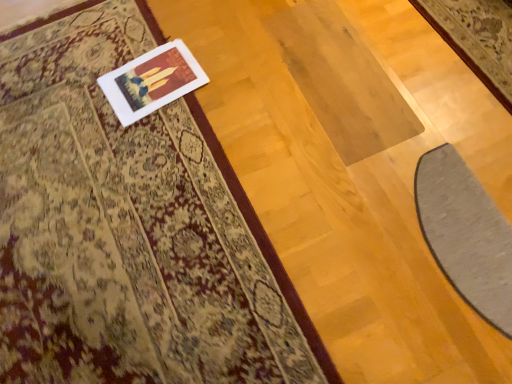
Image resolution: width=512 pixels, height=384 pixels. I want to click on free space above white matte picture frame at upper left (from a real-world perspective), so click(x=158, y=77).